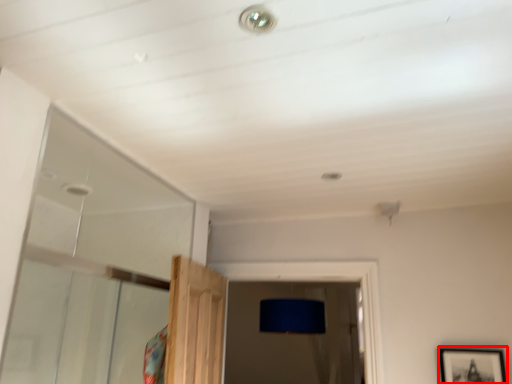
Question: From the image's perspective, where is picture frame (annotated by the red box) located in relation to droplight in the image?

Choices:
 (A) above
 (B) below

Answer: (B)